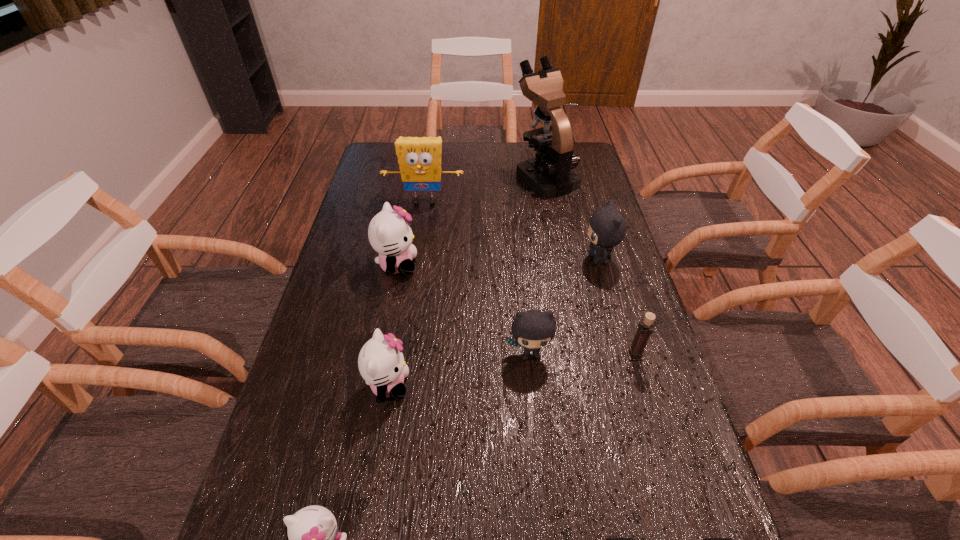
Where is `the second closest gray kitten to the dumbbell`? the second closest gray kitten to the dumbbell is located at coordinates (607, 227).

The height and width of the screenshot is (540, 960). In order to click on free space that satisfies the following two spatial constraints: 1. on the front-facing side of the candle holder; 2. on the left side of the left gray kitten in this screenshot , I will do `click(531, 355)`.

This screenshot has width=960, height=540. I want to click on free spot that satisfies the following two spatial constraints: 1. on the front side of the microscope; 2. on the front-facing side of the farthest white kitten, so click(563, 265).

Where is `vacant region that satisfies the following two spatial constraints: 1. on the face of the sponge; 2. on the left side of the candle holder`? vacant region that satisfies the following two spatial constraints: 1. on the face of the sponge; 2. on the left side of the candle holder is located at coordinates (401, 355).

Locate an element on the screen. This screenshot has height=540, width=960. vacant space that satisfies the following two spatial constraints: 1. on the face of the sponge; 2. on the front-facing side of the biggest white kitten is located at coordinates (415, 265).

Identify the location of vacant space that satisfies the following two spatial constraints: 1. on the face of the sponge; 2. on the front-facing side of the second smallest white kitten. The height and width of the screenshot is (540, 960). (396, 385).